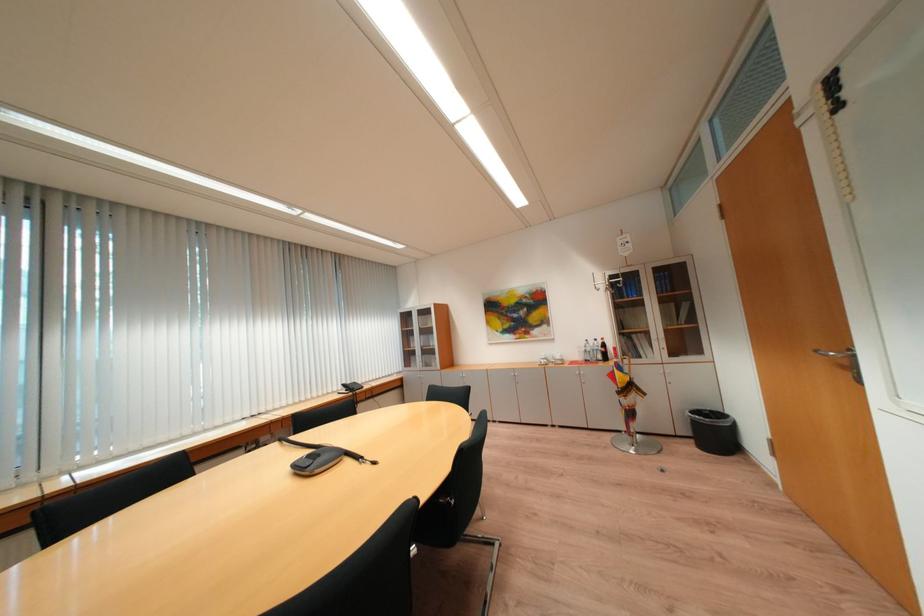
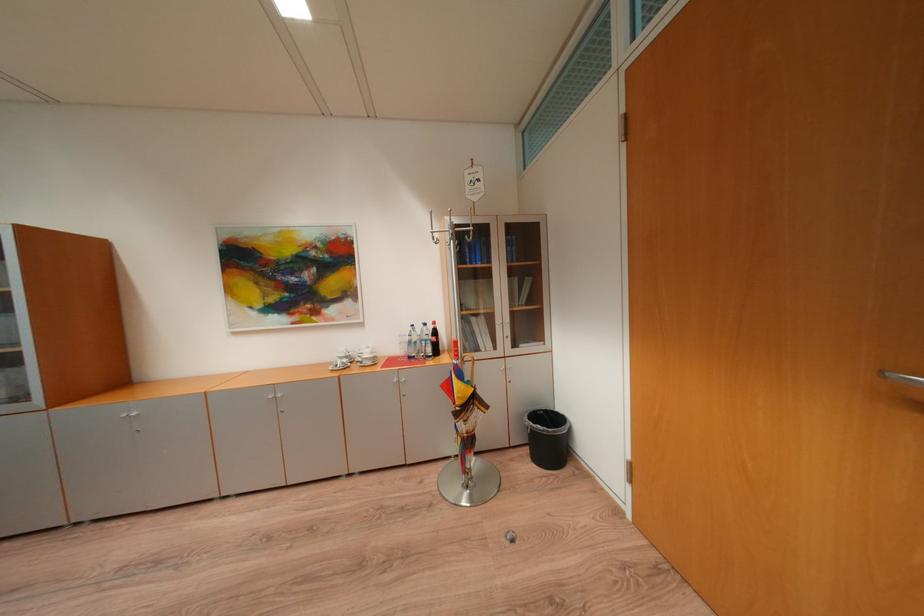
Find the pixel in the second image that matches point (723, 434) in the first image.

(556, 440)